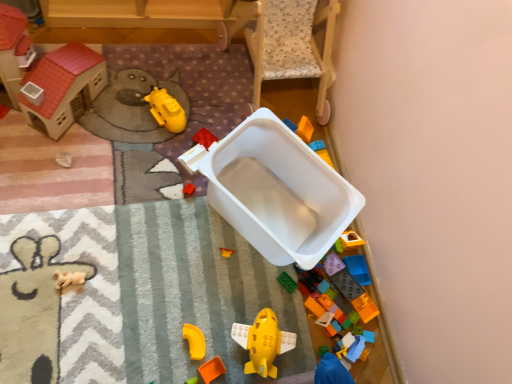
You are a GUI agent. You are given a task and a screenshot of the screen. Output one action in this format:
    pyautogui.click(x=<x>, y=<y>)
    Task: Click on the green matte toy at lower right, which is the fourth toy in right-to-left order
    
    Given the screenshot: What is the action you would take?
    pyautogui.click(x=322, y=350)

In order to click on yellow plastic airplane at center, placed as the 7th toy when sorted from left to right in this screenshot , I will do `click(263, 343)`.

What is the approximate width of yellow plastic submarine at upper center, which is the tenth toy in right-to-left order?

The width of yellow plastic submarine at upper center, which is the tenth toy in right-to-left order, is 11.12 centimeters.

In order to face wooden house at upper left, the 1th toy positioned from the left, should I rotate leftwards or rightwards?

Turn left by 29.220 degrees to look at wooden house at upper left, the 1th toy positioned from the left.

Describe the element at coordinates (64, 87) in the screenshot. This screenshot has width=512, height=384. I see `wooden house at upper left, acting as the eleventh toy starting from the right` at that location.

The height and width of the screenshot is (384, 512). What do you see at coordinates (278, 191) in the screenshot?
I see `white plastic container at center` at bounding box center [278, 191].

Identify the location of orange plastic toy at lower center, which ranks as the 6th toy in right-to-left order. (212, 369).

Image resolution: width=512 pixels, height=384 pixels. What do you see at coordinates (358, 269) in the screenshot? I see `translucent plastic toy at lower right, which is the tenth toy in left-to-right order` at bounding box center [358, 269].

This screenshot has width=512, height=384. I want to click on green matte toy at lower right, which is the fourth toy in right-to-left order, so click(x=322, y=350).

Considering the positions of point (205, 374) and point (151, 97), is point (205, 374) closer or farther from the camera than point (151, 97)?

Point (205, 374).

Does orange plastic toy at lower center, which ranks as the 6th toy in right-to-left order, turn towards yellow plastic submarine at upper center, which is the tenth toy in right-to-left order?

No, orange plastic toy at lower center, which ranks as the 6th toy in right-to-left order, is not facing towards yellow plastic submarine at upper center, which is the tenth toy in right-to-left order.

From the image's perspective, is orange plastic toy at lower center, which ranks as the 6th toy in right-to-left order, beneath yellow plastic submarine at upper center, acting as the 2th toy starting from the left?

Yes, from the image's perspective, orange plastic toy at lower center, which ranks as the 6th toy in right-to-left order, is beneath yellow plastic submarine at upper center, acting as the 2th toy starting from the left.

Between orange plastic toy at lower center, which ranks as the 6th toy in right-to-left order, and yellow plastic submarine at upper center, acting as the 2th toy starting from the left, which one has smaller size?

orange plastic toy at lower center, which ranks as the 6th toy in right-to-left order, is smaller.

Considering the sizes of objects green matte toy at lower right, which is the fourth toy in right-to-left order, and white plastic container at center in the image provided, who is thinner, green matte toy at lower right, which is the fourth toy in right-to-left order, or white plastic container at center?

With smaller width is green matte toy at lower right, which is the fourth toy in right-to-left order.

Is green matte toy at lower right, the eighth toy positioned from the left, outside of white plastic container at center?

Yes, green matte toy at lower right, the eighth toy positioned from the left, is located beyond the bounds of white plastic container at center.

Which is nearer, (319, 349) or (288, 248)?

The point (288, 248) is in front.

Between green matte toy at lower right, which is the fourth toy in right-to-left order, and white plastic container at center, which one appears on the left side from the viewer's perspective?

Positioned to the left is white plastic container at center.

From the image's perspective, which object appears higher, rubber brick at center, positioned as the fifth toy in left-to-right order, or white plastic container at center, which is the 3th toy in left-to-right order?

rubber brick at center, positioned as the fifth toy in left-to-right order.

Is rubber brick at center, positioned as the fifth toy in left-to-right order, looking in the opposite direction of white plastic container at center, the 9th toy from the right?

That's not correct — rubber brick at center, positioned as the fifth toy in left-to-right order, is not looking away from white plastic container at center, the 9th toy from the right.

Is rubber brick at center, positioned as the fifth toy in left-to-right order, bigger or smaller than white plastic container at center, which is the 3th toy in left-to-right order?

Considering their sizes, rubber brick at center, positioned as the fifth toy in left-to-right order, takes up less space than white plastic container at center, which is the 3th toy in left-to-right order.

Considering the sizes of objects rubber brick at center, acting as the seventh toy starting from the right, and white plastic container at center, the 9th toy from the right, in the image provided, who is shorter, rubber brick at center, acting as the seventh toy starting from the right, or white plastic container at center, the 9th toy from the right,?

rubber brick at center, acting as the seventh toy starting from the right.

From the image's perspective, is yellow plastic airplane at center, placed as the 7th toy when sorted from left to right, positioned above or below bright orange plastic blocks at lower right, which is the eleventh toy from left to right?

Based on their image positions, yellow plastic airplane at center, placed as the 7th toy when sorted from left to right, is located beneath bright orange plastic blocks at lower right, which is the eleventh toy from left to right.

Does yellow plastic airplane at center, placed as the 7th toy when sorted from left to right, have a greater height compared to bright orange plastic blocks at lower right, which is the eleventh toy from left to right?

Yes, yellow plastic airplane at center, placed as the 7th toy when sorted from left to right, is taller than bright orange plastic blocks at lower right, which is the eleventh toy from left to right.

Is yellow plastic airplane at center, placed as the 7th toy when sorted from left to right, oriented towards bright orange plastic blocks at lower right, which is the eleventh toy from left to right?

No.

Is yellow plastic airplane at center, placed as the 7th toy when sorted from left to right, directly adjacent to bright orange plastic blocks at lower right, the first toy viewed from the right?

No, yellow plastic airplane at center, placed as the 7th toy when sorted from left to right, is not beside bright orange plastic blocks at lower right, the first toy viewed from the right.

Based on the photo, is orange plastic toy at lower center, placed as the sixth toy when sorted from left to right, taller or shorter than yellow plastic airplane at center, placed as the 7th toy when sorted from left to right?

Clearly, orange plastic toy at lower center, placed as the sixth toy when sorted from left to right, is shorter compared to yellow plastic airplane at center, placed as the 7th toy when sorted from left to right.

Does orange plastic toy at lower center, placed as the sixth toy when sorted from left to right, turn towards yellow plastic airplane at center, arranged as the fifth toy when viewed from the right?

No, orange plastic toy at lower center, placed as the sixth toy when sorted from left to right, does not turn towards yellow plastic airplane at center, arranged as the fifth toy when viewed from the right.

Does orange plastic toy at lower center, placed as the sixth toy when sorted from left to right, have a lesser width compared to yellow plastic airplane at center, placed as the 7th toy when sorted from left to right?

Yes, orange plastic toy at lower center, placed as the sixth toy when sorted from left to right, is thinner than yellow plastic airplane at center, placed as the 7th toy when sorted from left to right.

Between green matte toy at lower right, the eighth toy positioned from the left, and yellow plastic submarine at upper center, acting as the 2th toy starting from the left, which one is positioned behind?

yellow plastic submarine at upper center, acting as the 2th toy starting from the left, is more distant.

Does green matte toy at lower right, which is the fourth toy in right-to-left order, contain yellow plastic submarine at upper center, acting as the 2th toy starting from the left?

No, yellow plastic submarine at upper center, acting as the 2th toy starting from the left, is not surrounded by green matte toy at lower right, which is the fourth toy in right-to-left order.

Image resolution: width=512 pixels, height=384 pixels. Find the location of `the 9th toy located beneath the yellow plastic submarine at upper center, acting as the 2th toy starting from the left (from a real-world perspective)`. the 9th toy located beneath the yellow plastic submarine at upper center, acting as the 2th toy starting from the left (from a real-world perspective) is located at coordinates (322, 350).

Is matte plastic toy house at lower right, positioned as the 3th toy in right-to-left order, taller than bright orange plastic blocks at lower right, the first toy viewed from the right?

Yes, matte plastic toy house at lower right, positioned as the 3th toy in right-to-left order, is taller than bright orange plastic blocks at lower right, the first toy viewed from the right.

Identify the location of toy that is the 6th object above the bright orange plastic blocks at lower right, which is the eleventh toy from left to right (from a real-world perspective). (351, 240).

Is matte plastic toy house at lower right, positioned as the 9th toy in left-to-right order, placed right next to bright orange plastic blocks at lower right, the first toy viewed from the right?

No, matte plastic toy house at lower right, positioned as the 9th toy in left-to-right order, is not touching bright orange plastic blocks at lower right, the first toy viewed from the right.

Looking at this image, can we say matte plastic toy house at lower right, positioned as the 3th toy in right-to-left order, lies outside bright orange plastic blocks at lower right, which is the eleventh toy from left to right?

Yes, matte plastic toy house at lower right, positioned as the 3th toy in right-to-left order, is not within bright orange plastic blocks at lower right, which is the eleventh toy from left to right.

What are the coordinates of `the 4th toy to the left of the orange plastic toy at lower center, placed as the sixth toy when sorted from left to right, starting your count from the anchor` in the screenshot? It's located at click(x=166, y=110).

Where is `toy that is the 1st one when counting rightward from the white plastic container at center`? Image resolution: width=512 pixels, height=384 pixels. toy that is the 1st one when counting rightward from the white plastic container at center is located at coordinates (322, 350).

From the image, which object appears to be farther from wooden house at upper left, acting as the eleventh toy starting from the right, yellow plastic submarine at upper center, which is the tenth toy in right-to-left order, or bright orange plastic blocks at lower right, the first toy viewed from the right?

bright orange plastic blocks at lower right, the first toy viewed from the right, is positioned further to the anchor wooden house at upper left, acting as the eleventh toy starting from the right.

From the image, which object appears to be farther from wooden house at upper left, acting as the eleventh toy starting from the right, matte plastic toy house at lower right, positioned as the 3th toy in right-to-left order, or yellow plastic curve at lower center, which is counted as the 4th toy, starting from the left?

Among the two, matte plastic toy house at lower right, positioned as the 3th toy in right-to-left order, is located further to wooden house at upper left, acting as the eleventh toy starting from the right.

From the image, which object appears to be farther from green matte toy at lower right, the eighth toy positioned from the left, yellow plastic airplane at center, placed as the 7th toy when sorted from left to right, or white plastic container at center, the 9th toy from the right?

white plastic container at center, the 9th toy from the right, lies further to green matte toy at lower right, the eighth toy positioned from the left, than the other object.

Based on their spatial positions, is yellow plastic curve at lower center, which is counted as the 4th toy, starting from the left, or rubber brick at center, acting as the seventh toy starting from the right, closer to orange plastic toy at lower center, which ranks as the 6th toy in right-to-left order?

yellow plastic curve at lower center, which is counted as the 4th toy, starting from the left, lies closer to orange plastic toy at lower center, which ranks as the 6th toy in right-to-left order, than the other object.

When comparing their distances from translucent plastic toy at lower right, the 2th toy viewed from the right, does wooden house at upper left, the 1th toy positioned from the left, or white plastic container at center, which is the 3th toy in left-to-right order, seem further?

The object further to translucent plastic toy at lower right, the 2th toy viewed from the right, is wooden house at upper left, the 1th toy positioned from the left.

Which object lies nearer to the anchor point white plastic container at center, the 9th toy from the right, rubber brick at center, positioned as the fifth toy in left-to-right order, or green matte toy at lower right, the eighth toy positioned from the left?

The object closer to white plastic container at center, the 9th toy from the right, is rubber brick at center, positioned as the fifth toy in left-to-right order.

Which object lies nearer to the anchor point wooden house at upper left, the 1th toy positioned from the left, white plastic container at center or yellow plastic curve at lower center, arranged as the 8th toy when viewed from the right?

white plastic container at center is positioned closer to the anchor wooden house at upper left, the 1th toy positioned from the left.

From the image, which object appears to be nearer to translucent plastic toy at lower right, which is the tenth toy in left-to-right order, orange plastic toy at lower center, which ranks as the 6th toy in right-to-left order, or matte plastic toy house at lower right, positioned as the 9th toy in left-to-right order?

matte plastic toy house at lower right, positioned as the 9th toy in left-to-right order, lies closer to translucent plastic toy at lower right, which is the tenth toy in left-to-right order, than the other object.

Where is `storage box situated between white plastic container at center, which is the 3th toy in left-to-right order, and matte plastic toy house at lower right, positioned as the 3th toy in right-to-left order, from left to right`? Image resolution: width=512 pixels, height=384 pixels. storage box situated between white plastic container at center, which is the 3th toy in left-to-right order, and matte plastic toy house at lower right, positioned as the 3th toy in right-to-left order, from left to right is located at coordinates (278, 191).

I want to click on storage box between white plastic container at center, the 9th toy from the right, and yellow plastic curve at lower center, arranged as the 8th toy when viewed from the right, in the vertical direction, so click(278, 191).

This screenshot has height=384, width=512. I want to click on storage box between rubber brick at center, acting as the seventh toy starting from the right, and yellow plastic airplane at center, placed as the 7th toy when sorted from left to right, in the vertical direction, so click(278, 191).

Find the location of a particular element. The height and width of the screenshot is (384, 512). storage box located between white plastic container at center, which is the 3th toy in left-to-right order, and translucent plastic toy at lower right, the 2th toy viewed from the right, in the left-right direction is located at coordinates (278, 191).